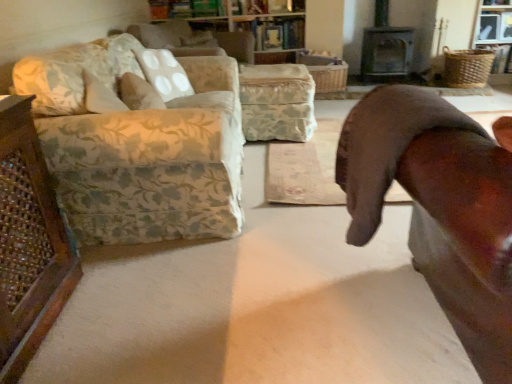
Question: Does brown leather chair at right appear on the right side of wooden bookshelf at upper center?

Choices:
 (A) no
 (B) yes

Answer: (B)

Question: Is brown leather chair at right outside of wooden bookshelf at upper center?

Choices:
 (A) no
 (B) yes

Answer: (B)

Question: Is brown leather chair at right taller than wooden bookshelf at upper center?

Choices:
 (A) yes
 (B) no

Answer: (A)

Question: Can you confirm if brown leather chair at right is smaller than wooden bookshelf at upper center?

Choices:
 (A) no
 (B) yes

Answer: (A)

Question: Is wooden bookshelf at upper center surrounded by brown leather chair at right?

Choices:
 (A) yes
 (B) no

Answer: (B)

Question: From the image's perspective, would you say brown leather chair at right is shown under wooden bookshelf at upper center?

Choices:
 (A) no
 (B) yes

Answer: (B)

Question: Does floral fabric couch at left have a greater width compared to metallic gray fireplace at upper right?

Choices:
 (A) no
 (B) yes

Answer: (B)

Question: From a real-world perspective, is floral fabric couch at left physically below metallic gray fireplace at upper right?

Choices:
 (A) yes
 (B) no

Answer: (A)

Question: Is metallic gray fireplace at upper right completely or partially inside floral fabric couch at left?

Choices:
 (A) no
 (B) yes

Answer: (A)

Question: Is floral fabric couch at left oriented away from metallic gray fireplace at upper right?

Choices:
 (A) yes
 (B) no

Answer: (B)

Question: Does floral fabric couch at left have a larger size compared to metallic gray fireplace at upper right?

Choices:
 (A) no
 (B) yes

Answer: (B)

Question: Is floral fabric couch at left located outside metallic gray fireplace at upper right?

Choices:
 (A) no
 (B) yes

Answer: (B)

Question: From the image's perspective, does brown leather chair at right appear lower than floral fabric couch at left?

Choices:
 (A) yes
 (B) no

Answer: (A)